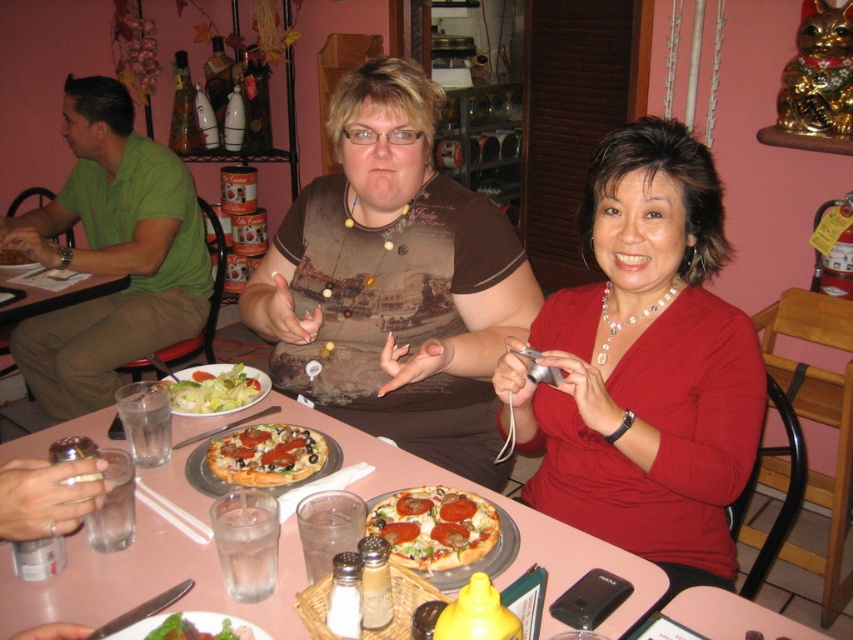
You are a food critic who wants to compare the sizes of the golden crispy pizza at center and the green leafy salad at center in the image. Which one is larger?

The green leafy salad at center is larger than the golden crispy pizza at center.